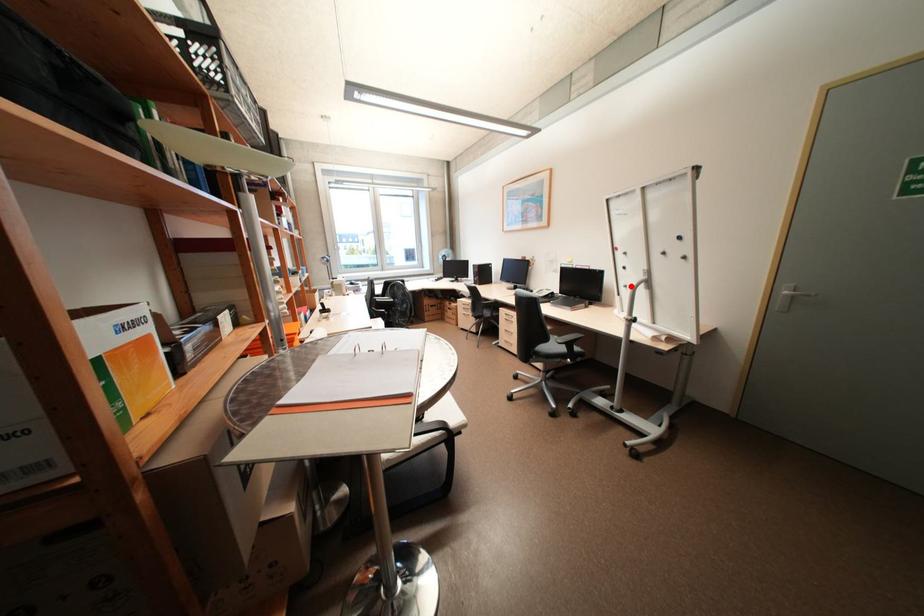
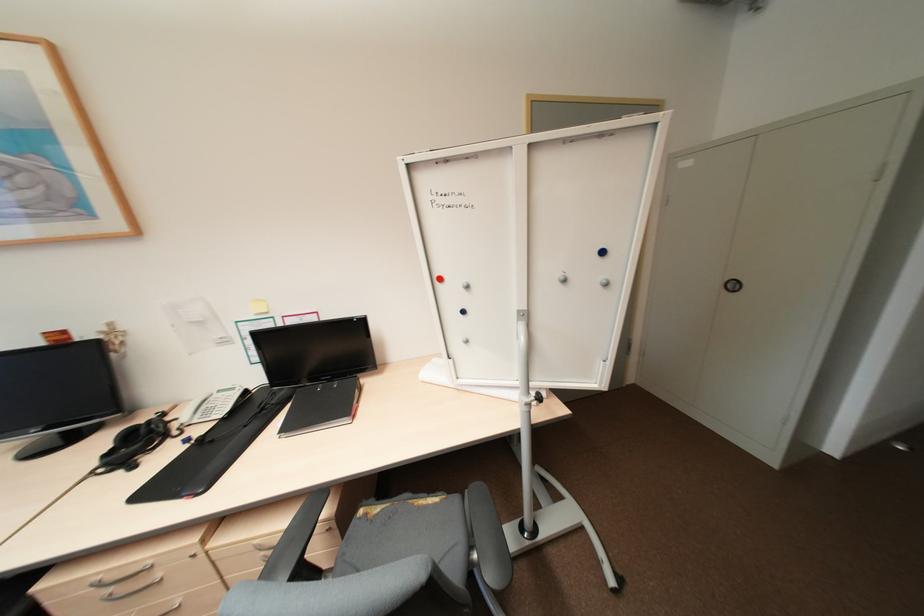
Find the pixel in the second image that matches the highlighted location in the first image.

(472, 341)